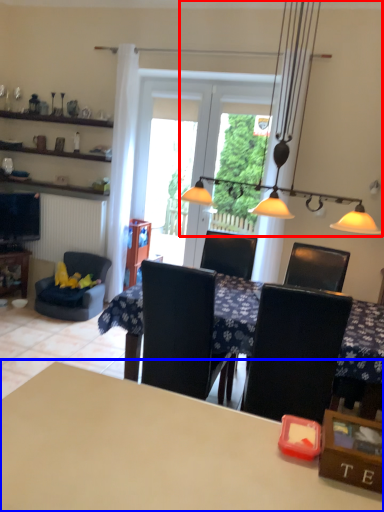
Question: Among these objects, which one is farthest to the camera, light fixture (highlighted by a red box) or table (highlighted by a blue box)?

Choices:
 (A) light fixture
 (B) table

Answer: (A)